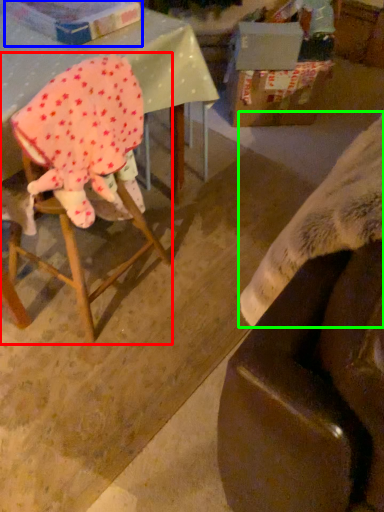
Question: Which object is positioned farthest from chair (highlighted by a red box)? Select from cardboard box (highlighted by a blue box) and blanket (highlighted by a green box).

Choices:
 (A) cardboard box
 (B) blanket

Answer: (B)